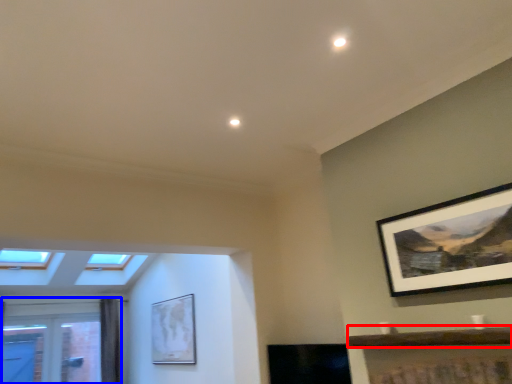
Question: Which object is closer to the camera taking this photo, window sill (highlighted by a red box) or window (highlighted by a blue box)?

Choices:
 (A) window sill
 (B) window

Answer: (A)